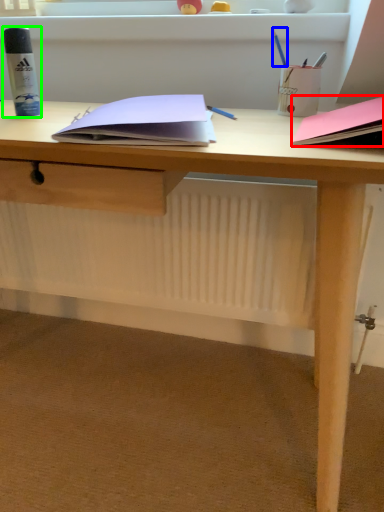
Question: Which object is the closest to the paperback book (highlighted by a red box)? Choose among these: stationery (highlighted by a blue box) or stationery (highlighted by a green box).

Choices:
 (A) stationery
 (B) stationery

Answer: (A)